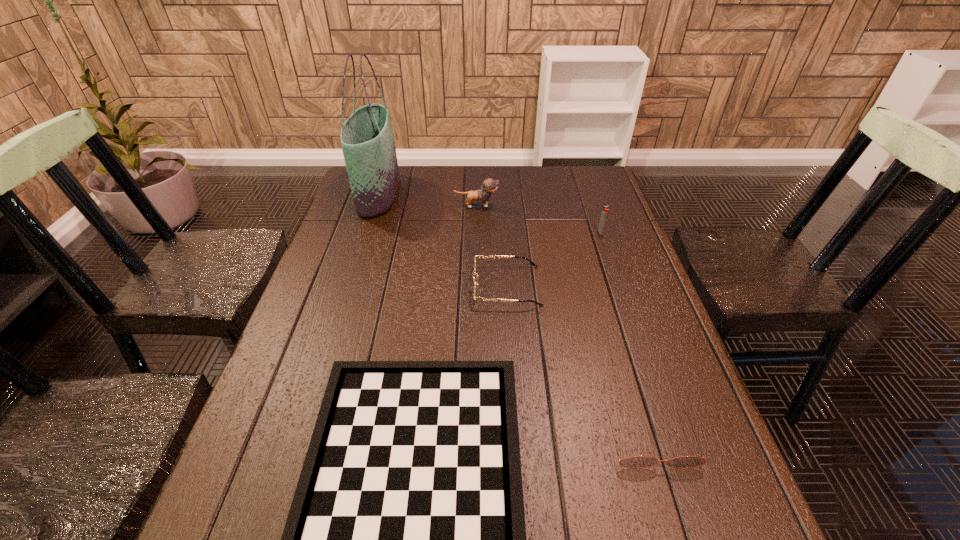
The image size is (960, 540). I want to click on the third closest object to the sunglasses, so click(x=604, y=213).

Identify which object is the nearest to the kitten. Please provide its 2D coordinates. Your answer should be formatted as a tuple, i.e. [(x, y)], where the tuple contains the x and y coordinates of a point satisfying the conditions above.

[(367, 140)]

Find the location of a particular element. free spot that satisfies the following two spatial constraints: 1. on the front-facing side of the kitten; 2. on the back side of the fourth nearest object is located at coordinates (476, 232).

The image size is (960, 540). I want to click on vacant space that satisfies the following two spatial constraints: 1. on the front-facing side of the fourth nearest object; 2. on the left side of the kitten, so coord(476,232).

Where is `vacant space that satisfies the following two spatial constraints: 1. on the front-facing side of the fourth nearest object; 2. on the left side of the kitten`? This screenshot has height=540, width=960. vacant space that satisfies the following two spatial constraints: 1. on the front-facing side of the fourth nearest object; 2. on the left side of the kitten is located at coordinates (476, 232).